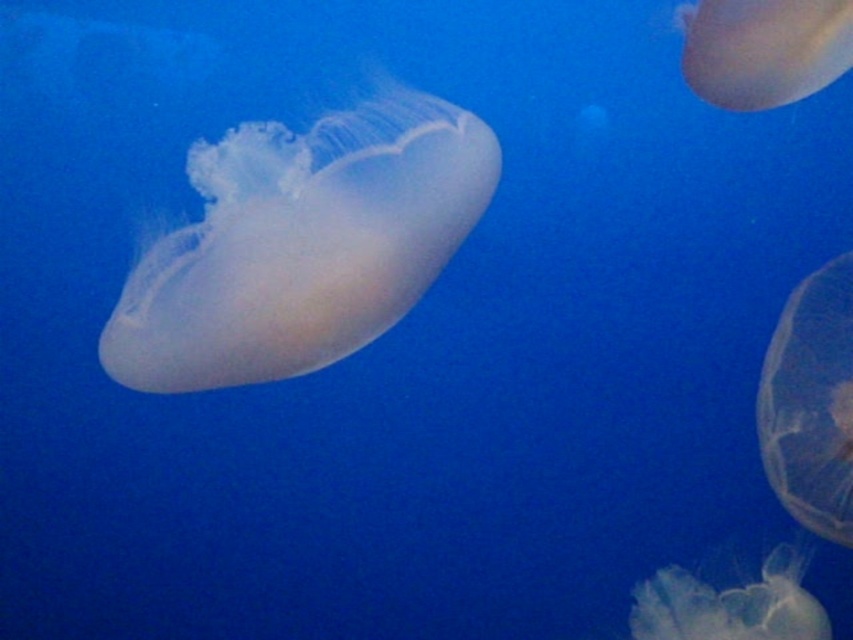
Question: Where is transparent gelatinous at right located in relation to translucent gelatinous at lower right in the image?

Choices:
 (A) below
 (B) above

Answer: (B)

Question: Which of the following is the closest to the observer?

Choices:
 (A) translucent gelatinous at upper right
 (B) transparent gelatinous at right
 (C) translucent gelatinous at lower right
 (D) translucent white jellyfish at center

Answer: (D)

Question: Which object appears farthest from the camera in this image?

Choices:
 (A) transparent gelatinous at right
 (B) translucent white jellyfish at center
 (C) translucent gelatinous at lower right

Answer: (C)

Question: Does translucent white jellyfish at center appear on the left side of transparent gelatinous at right?

Choices:
 (A) no
 (B) yes

Answer: (B)

Question: Is translucent gelatinous at upper right below translucent gelatinous at lower right?

Choices:
 (A) no
 (B) yes

Answer: (A)

Question: Which point is closer to the camera taking this photo?

Choices:
 (A) [x=248, y=250]
 (B) [x=769, y=625]
 (C) [x=744, y=100]
 (D) [x=845, y=406]

Answer: (A)